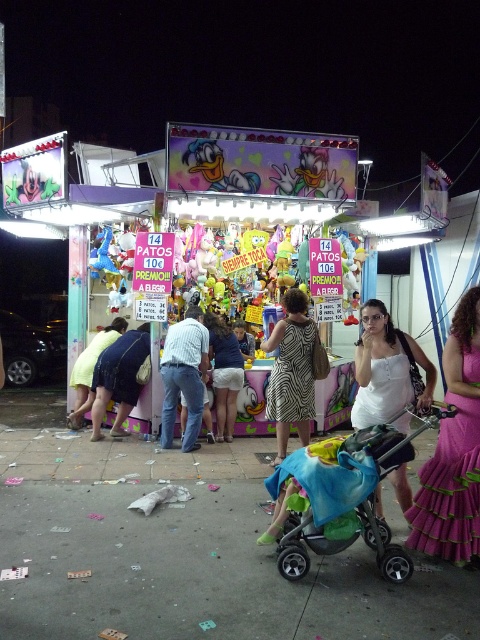
Which is below, pink satin dress at lower right or striped fabric shirt at center?

Positioned lower is pink satin dress at lower right.

Between pink satin dress at lower right and striped fabric shirt at center, which one appears on the right side from the viewer's perspective?

Positioned to the right is pink satin dress at lower right.

Between point (465, 529) and point (175, 353), which one is positioned behind?

The point (175, 353) is more distant.

Image resolution: width=480 pixels, height=640 pixels. Find the location of `pink satin dress at lower right`. pink satin dress at lower right is located at coordinates (450, 488).

Is white matte dress at center further to the viewer compared to zebra-patterned dress at center?

No, white matte dress at center is in front of zebra-patterned dress at center.

Which of these two, white matte dress at center or zebra-patterned dress at center, stands shorter?

white matte dress at center

Is point (395, 333) more distant than point (311, 388)?

No, it is not.

Where is `white matte dress at center`? Image resolution: width=480 pixels, height=640 pixels. white matte dress at center is located at coordinates (385, 369).

Who is higher up, white matte dress at center or zebra print dress at center?

white matte dress at center

Which is below, white matte dress at center or zebra print dress at center?

zebra print dress at center

Where is `white matte dress at center`? Image resolution: width=480 pixels, height=640 pixels. white matte dress at center is located at coordinates (385, 369).